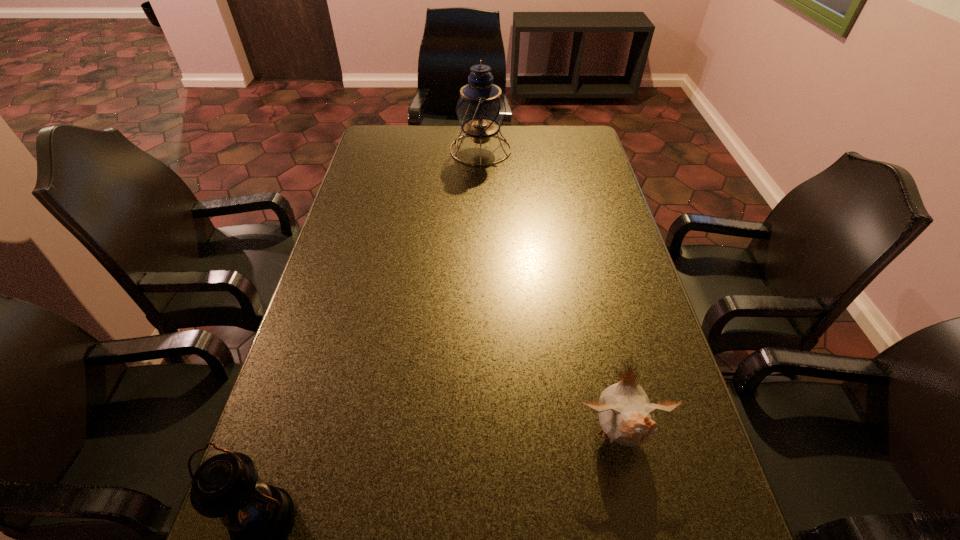
In the image, there is a desktop. What are the coordinates of `vacant space at the far edge` in the screenshot? It's located at (410, 142).

At what (x,y) coordinates should I click in order to perform the action: click on free space at the left edge of the desktop. Please return your answer as a coordinate pair (x, y). Looking at the image, I should click on (338, 253).

The height and width of the screenshot is (540, 960). Identify the location of vacant region at the right edge of the desktop. (608, 207).

The width and height of the screenshot is (960, 540). Identify the location of vacant space at the far right corner of the desktop. (560, 132).

The height and width of the screenshot is (540, 960). Identify the location of unoccupied area between the right lantern and the rightmost object. (550, 292).

At what (x,y) coordinates should I click in order to perform the action: click on vacant area between the shortest object and the right lantern. Please return your answer as a coordinate pair (x, y). The image size is (960, 540). Looking at the image, I should click on (550, 292).

The height and width of the screenshot is (540, 960). What are the coordinates of `free area in between the shortest object and the second object from left to right` in the screenshot? It's located at (550, 292).

Where is `object that is the closest to the bird`? Image resolution: width=960 pixels, height=540 pixels. object that is the closest to the bird is located at coordinates (258, 517).

Where is `object that ranks as the closest to the tallest object`? object that ranks as the closest to the tallest object is located at coordinates (626, 416).